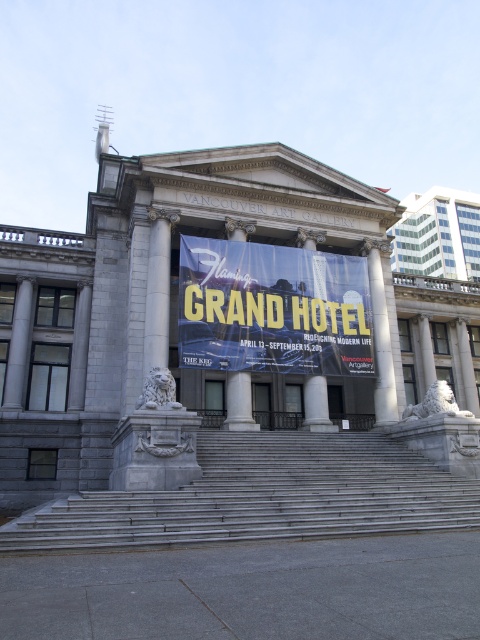
You are standing in front of the Vancouver Art Gallery and notice a point marked at coordinates (273, 308). Based on the scene description, can you determine which object this point is located on?

The point at coordinates (273, 308) is located on the blue fabric banner at center.

You are standing in front of the Vancouver Art Gallery and want to enter through the main entrance. The main entrance is located below the blue fabric banner at center. Are the gray stone stairs at center leading up to the main entrance? Please explain your reasoning.

The gray stone stairs at center is positioned under blue fabric banner at center, so yes, the gray stone stairs at center are leading up to the main entrance located below the blue fabric banner at center.